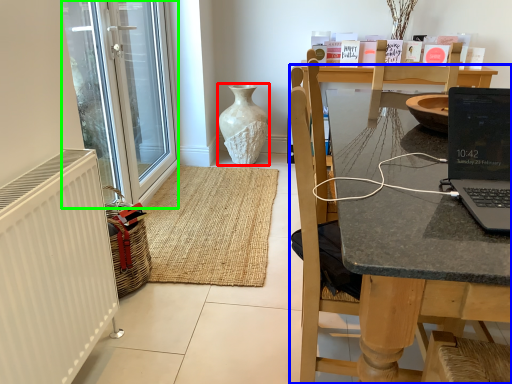
Question: Which object is positioned closest to vase (highlighted by a red box)? Select from chair (highlighted by a blue box) and glass door (highlighted by a green box).

Choices:
 (A) chair
 (B) glass door

Answer: (B)